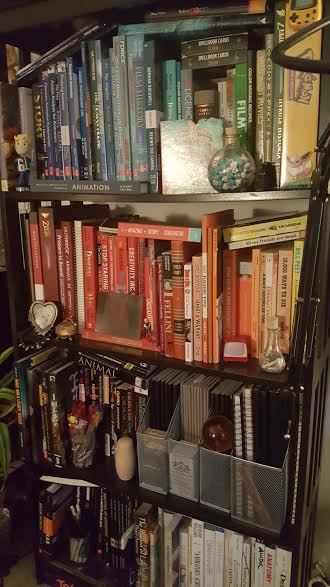
Identify the location of statue. (124, 458).